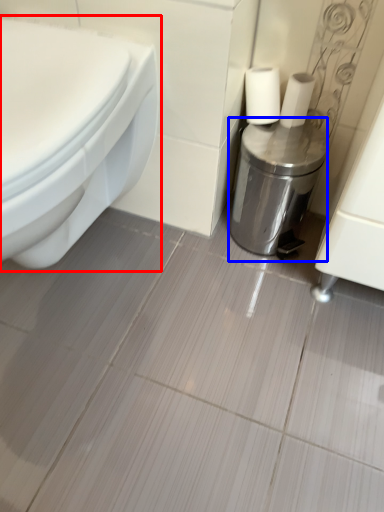
Question: Among these objects, which one is nearest to the camera, toilet (highlighted by a red box) or dispenser (highlighted by a blue box)?

Choices:
 (A) toilet
 (B) dispenser

Answer: (A)